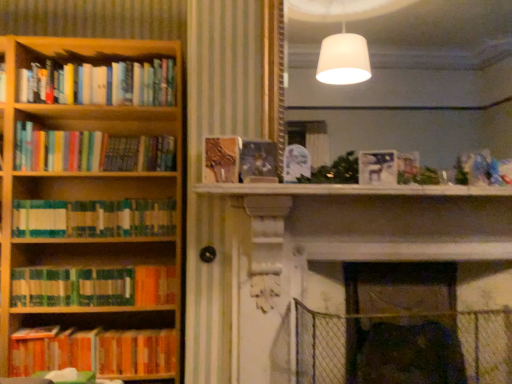
At what (x,y) coordinates should I click in order to perform the action: click on free space above hardcover books at left, which ranks as the 6th book in bottom-to-top order (from a real-world perspective). Please return your answer as a coordinate pair (x, y). The height and width of the screenshot is (384, 512). Looking at the image, I should click on 99,52.